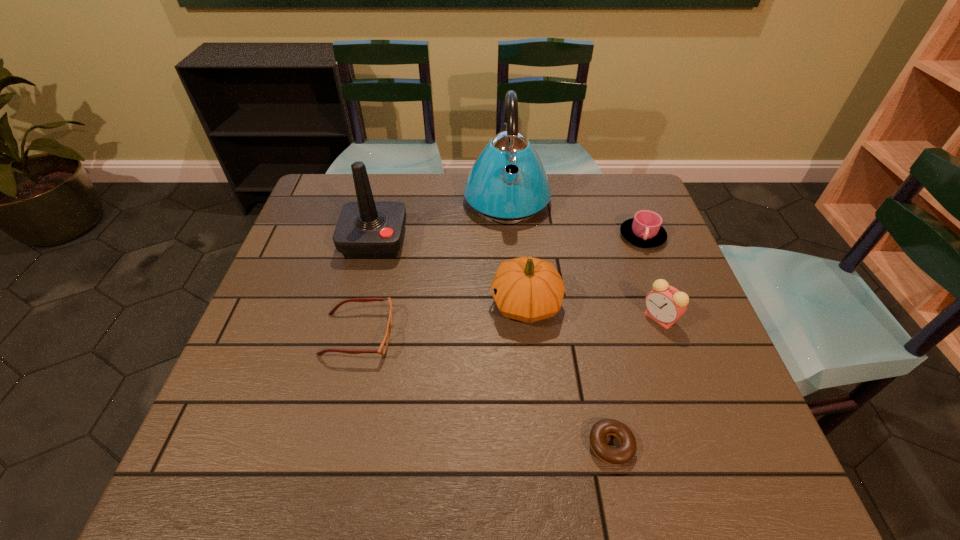
Image resolution: width=960 pixels, height=540 pixels. Identify the location of object located in the near edge section of the desktop. (625, 452).

Find the location of a particular element. The height and width of the screenshot is (540, 960). object that is at the left edge is located at coordinates (365, 229).

The image size is (960, 540). Identify the location of alarm clock present at the right edge. (665, 304).

Where is `cup located in the right edge section of the desktop`? The image size is (960, 540). cup located in the right edge section of the desktop is located at coordinates (644, 230).

Where is `free region at the far edge`? The image size is (960, 540). free region at the far edge is located at coordinates (424, 179).

The image size is (960, 540). In the image, there is a desktop. What are the coordinates of `vacant space at the left edge` in the screenshot? It's located at (277, 305).

What are the coordinates of `vacant space at the right edge` in the screenshot? It's located at (632, 277).

Where is `vacant space at the far left corner of the desktop`? The width and height of the screenshot is (960, 540). vacant space at the far left corner of the desktop is located at coordinates (332, 180).

In the image, there is a desktop. Identify the location of vacant space at the far right corner. The width and height of the screenshot is (960, 540). (611, 219).

Identify the location of free space between the cup and the sixth shortest object. This screenshot has height=540, width=960. (509, 239).